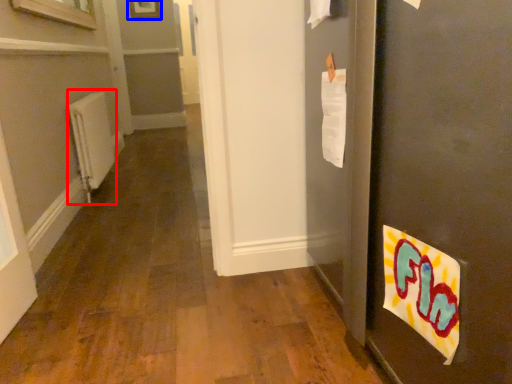
Question: Among these objects, which one is nearest to the camera, radiator (highlighted by a red box) or picture frame (highlighted by a blue box)?

Choices:
 (A) radiator
 (B) picture frame

Answer: (A)